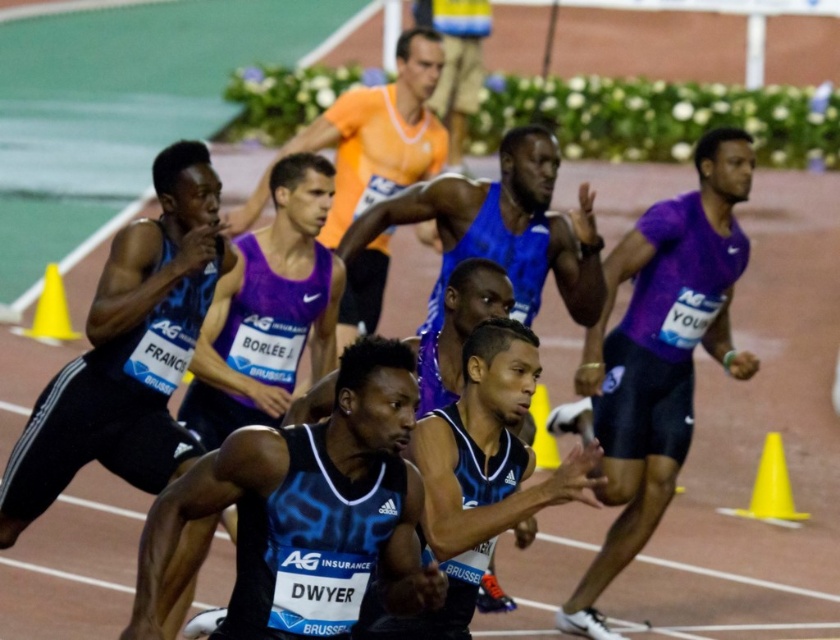
You are a photographer at the track and field event. You want to capture a photo where the purple matte shirt at right is in the foreground and the yellow plastic cone at left is in the background. Is this possible based on their positions?

The purple matte shirt at right is located below the yellow plastic cone at left, meaning the shirt is closer to the photographer. Therefore, positioning the purple matte shirt at right in the foreground and the yellow plastic cone at left in the background is achievable by focusing on the shirt while including the cone in the background.

You are a photographer positioned at the starting line of the sprint race. You want to capture a photo of the purple matte shirt at right and the yellow plastic cone at right. Which object will appear larger in your photo?

The purple matte shirt at right will appear larger in the photo because it is closer to the viewer than the yellow plastic cone at right.

You are a photographer positioned at the starting line of the sprint race. You want to capture a photo that includes both the purple matte shirt at right and the yellow plastic cone at left. Which object will appear larger in your photo?

The purple matte shirt at right will appear larger in the photo because it is closer to the viewer than the yellow plastic cone at left.